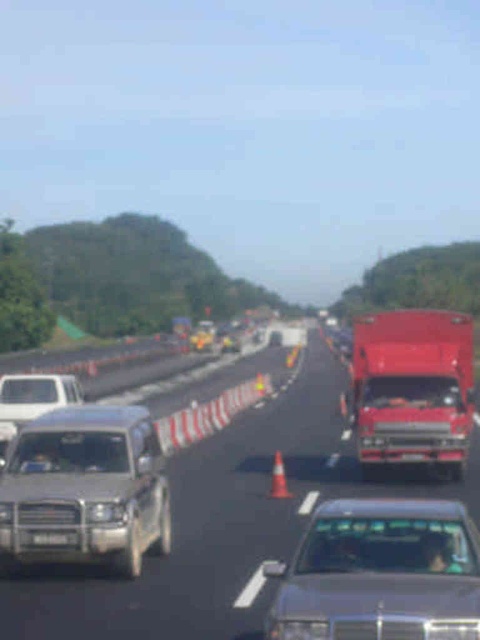
Is metallic silver sedan at center bigger than shiny red truck at center?

No, metallic silver sedan at center is not bigger than shiny red truck at center.

Is metallic silver sedan at center to the left of shiny red truck at center from the viewer's perspective?

Correct, you'll find metallic silver sedan at center to the left of shiny red truck at center.

Is point (459, 548) more distant than point (406, 406)?

No, it is in front of (406, 406).

Identify the location of metallic silver sedan at center. (381, 573).

Is metallic silver truck at center below metallic silver sedan at center?

Yes.

The image size is (480, 640). What do you see at coordinates (223, 524) in the screenshot? I see `metallic silver truck at center` at bounding box center [223, 524].

Does point (322, 404) come farther from viewer compared to point (441, 545)?

That is True.

Where is `metallic silver truck at center`? metallic silver truck at center is located at coordinates (223, 524).

Does point (24, 614) come farther from viewer compared to point (162, 509)?

No.

Can you confirm if metallic silver truck at center is taller than silver metallic suv at center?

No.

Who is more forward, (177, 508) or (115, 496)?

Point (115, 496) is more forward.

I want to click on metallic silver truck at center, so click(223, 524).